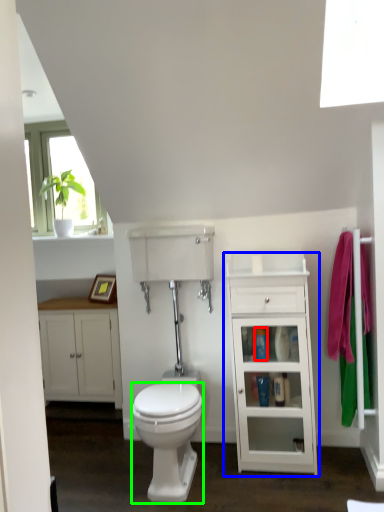
Question: Based on their relative distances, which object is farther from toiletry (highlighted by a red box)? Choose from cabinetry (highlighted by a blue box) and bidet (highlighted by a green box).

Choices:
 (A) cabinetry
 (B) bidet

Answer: (B)